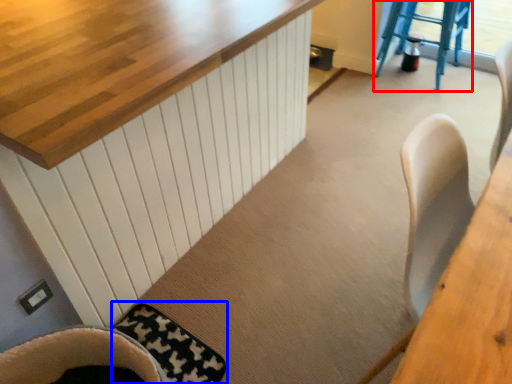
Question: Which object appears closest to the camera in this image, step stool (highlighted by a red box) or mat (highlighted by a blue box)?

Choices:
 (A) step stool
 (B) mat

Answer: (B)